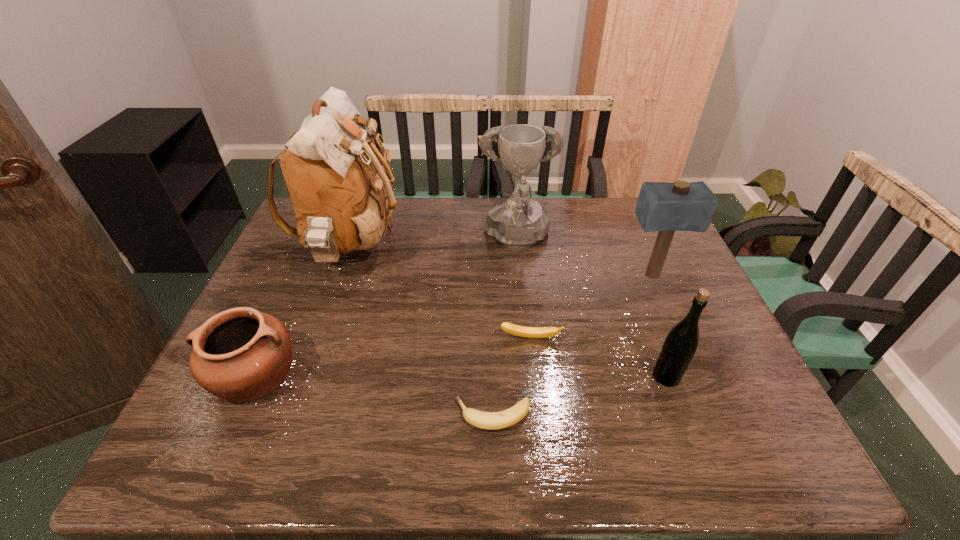
This screenshot has height=540, width=960. What are the coordinates of `free location located 0.130m on the side with emblem of the second tallest object` in the screenshot? It's located at (x=522, y=295).

This screenshot has height=540, width=960. I want to click on free space located 0.240m on the left of the mallet, so click(539, 275).

This screenshot has width=960, height=540. Find the location of `free space located on the back of the beer bottle`. free space located on the back of the beer bottle is located at coordinates (628, 274).

At what (x,y) coordinates should I click in order to perform the action: click on vacant space located 0.240m on the right of the pottery. Please return your answer as a coordinate pair (x, y). Looking at the image, I should click on (402, 375).

Locate an element on the screen. The image size is (960, 540). vacant region located at the stem of the sixth tallest object is located at coordinates (540, 421).

What are the coordinates of `vacant space positioned at the stem of the nearer banana` in the screenshot? It's located at (351, 415).

Where is `free region located 0.290m at the stem of the nearer banana`? This screenshot has width=960, height=540. free region located 0.290m at the stem of the nearer banana is located at coordinates (318, 415).

This screenshot has width=960, height=540. I want to click on vacant region located at the stem of the nearer banana, so click(x=355, y=415).

Where is `backpack located at the far edge`? This screenshot has height=540, width=960. backpack located at the far edge is located at coordinates (342, 196).

Image resolution: width=960 pixels, height=540 pixels. I want to click on award at the far edge, so click(518, 222).